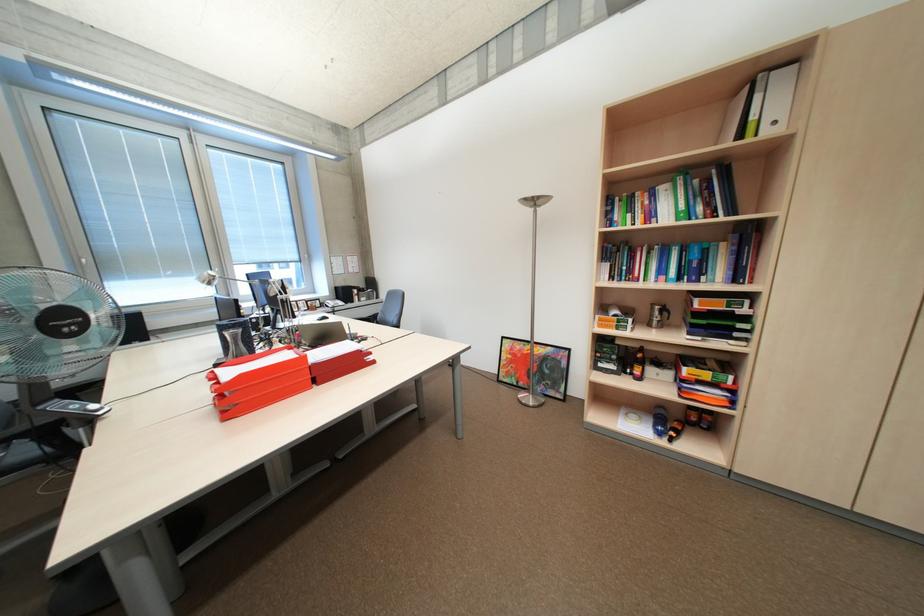
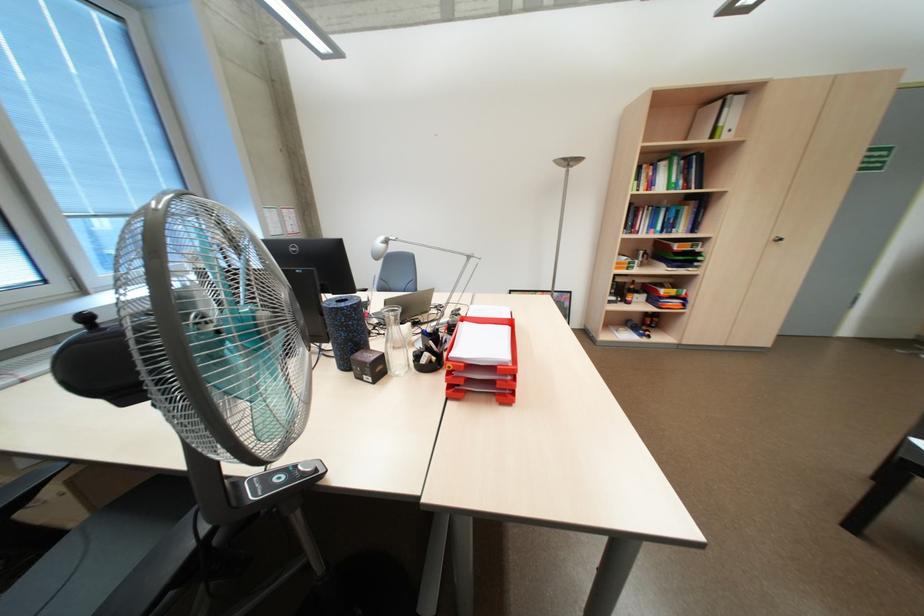
The point at (x=715, y=374) is marked in the first image. Where is the corresponding point in the second image?

(683, 291)